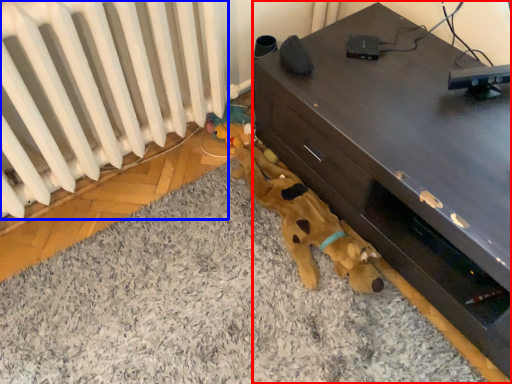
Question: Among these objects, which one is farthest to the camera, furniture (highlighted by a red box) or radiator (highlighted by a blue box)?

Choices:
 (A) furniture
 (B) radiator

Answer: (A)